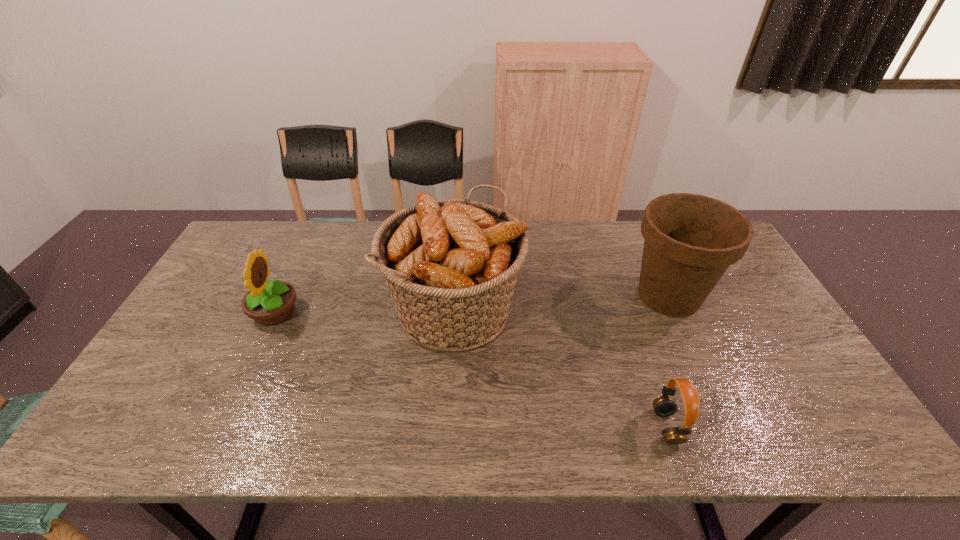
This screenshot has width=960, height=540. Find the location of `unoccupied area between the headset and the flowerpot`. unoccupied area between the headset and the flowerpot is located at coordinates (667, 361).

Locate an element on the screen. The width and height of the screenshot is (960, 540). free space that is in between the sunflower and the shortest object is located at coordinates coord(470,369).

You are a GUI agent. You are given a task and a screenshot of the screen. Output one action in this format:
    pyautogui.click(x=<x>, y=<y>)
    Task: Click on the empty space between the second object from left to right and the third tallest object
    The image size is (960, 540).
    Given the screenshot: What is the action you would take?
    pyautogui.click(x=365, y=310)

Where is `blank region between the second object from left to right and the leftmost object`? blank region between the second object from left to right and the leftmost object is located at coordinates (365, 310).

You are a GUI agent. You are given a task and a screenshot of the screen. Output one action in this format:
    pyautogui.click(x=<x>, y=<y>)
    Task: Click on the unoccupied area between the shortest object and the flowerpot
    
    Given the screenshot: What is the action you would take?
    pyautogui.click(x=667, y=361)

Locate an element on the screen. The width and height of the screenshot is (960, 540). vacant area between the third tallest object and the second object from left to right is located at coordinates (365, 310).

At what (x,y) coordinates should I click in order to perform the action: click on vacant area between the shortest object and the basket. Please return your answer as a coordinate pair (x, y). Image resolution: width=960 pixels, height=540 pixels. Looking at the image, I should click on (561, 368).

Where is `vacant space in between the headset and the basket`? Image resolution: width=960 pixels, height=540 pixels. vacant space in between the headset and the basket is located at coordinates (561, 368).

Locate an element on the screen. This screenshot has width=960, height=540. vacant space in between the nearest object and the flowerpot is located at coordinates (667, 361).

Select which object is the second closest to the leftmost object. Please provide its 2D coordinates. Your answer should be formatted as a tuple, i.e. [(x, y)], where the tuple contains the x and y coordinates of a point satisfying the conditions above.

[(664, 406)]